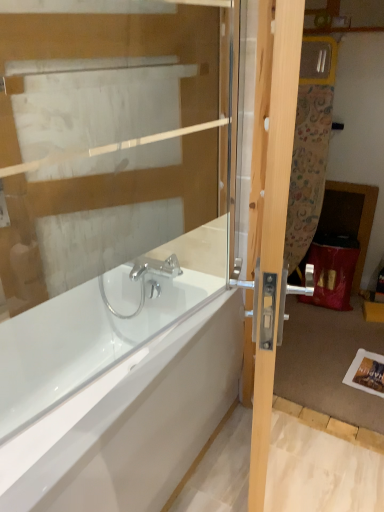
Question: From a real-world perspective, is white glossy bathtub at center positioned above or below transparent glass door at upper center?

Choices:
 (A) below
 (B) above

Answer: (A)

Question: In the image, is white glossy bathtub at center on the left side or the right side of transparent glass door at upper center?

Choices:
 (A) right
 (B) left

Answer: (B)

Question: Which object is positioned closest to the white glossy bathtub at center?

Choices:
 (A) light wood door at right
 (B) transparent glass door at upper center

Answer: (A)

Question: Which of these objects is positioned closest to the transparent glass door at upper center?

Choices:
 (A) white glossy bathtub at center
 (B) light wood door at right

Answer: (B)